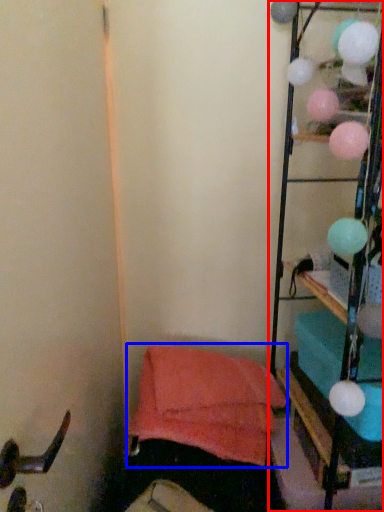
Question: Among these objects, which one is farthest to the camera, furniture (highlighted by a red box) or bean bag chair (highlighted by a blue box)?

Choices:
 (A) furniture
 (B) bean bag chair

Answer: (B)